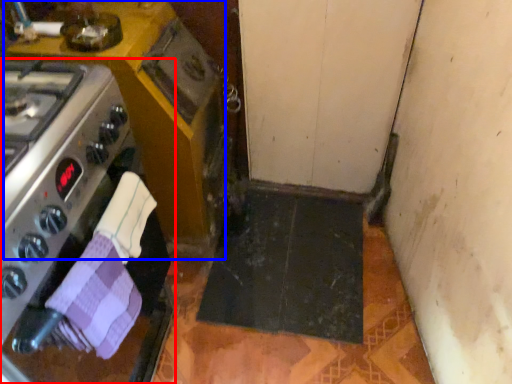
Question: Among these objects, which one is nearest to the camera, kitchen appliance (highlighted by a red box) or cabinetry (highlighted by a blue box)?

Choices:
 (A) kitchen appliance
 (B) cabinetry

Answer: (A)